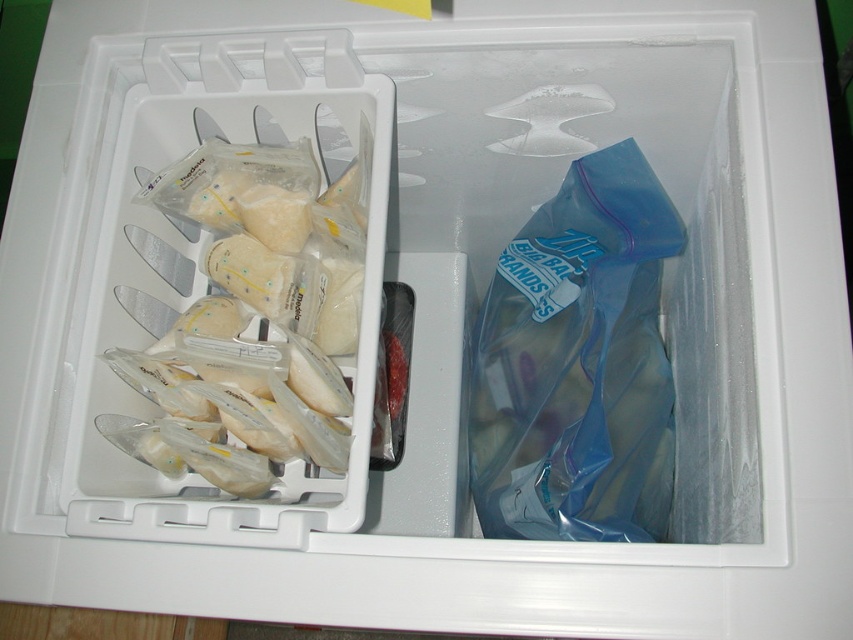
Question: Does transparent plastic bag at right lie in front of translucent plastic bags at left?

Choices:
 (A) no
 (B) yes

Answer: (B)

Question: Which point appears closest to the camera in this image?

Choices:
 (A) (235, 428)
 (B) (575, 531)

Answer: (B)

Question: Can you confirm if transparent plastic bag at right is positioned above translucent plastic bags at left?

Choices:
 (A) yes
 (B) no

Answer: (B)

Question: Which point is closer to the camera?

Choices:
 (A) click(585, 310)
 (B) click(207, 157)

Answer: (B)

Question: Can you confirm if transparent plastic bag at right is positioned above translucent plastic bags at left?

Choices:
 (A) yes
 (B) no

Answer: (B)

Question: Which object is farther from the camera taking this photo?

Choices:
 (A) translucent plastic bags at left
 (B) transparent plastic bag at right

Answer: (A)